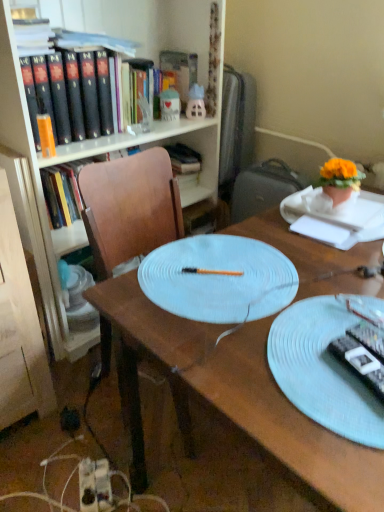
Where is `vacant space in front of orange fabric flower pot at upper right`? The image size is (384, 512). vacant space in front of orange fabric flower pot at upper right is located at coordinates click(347, 218).